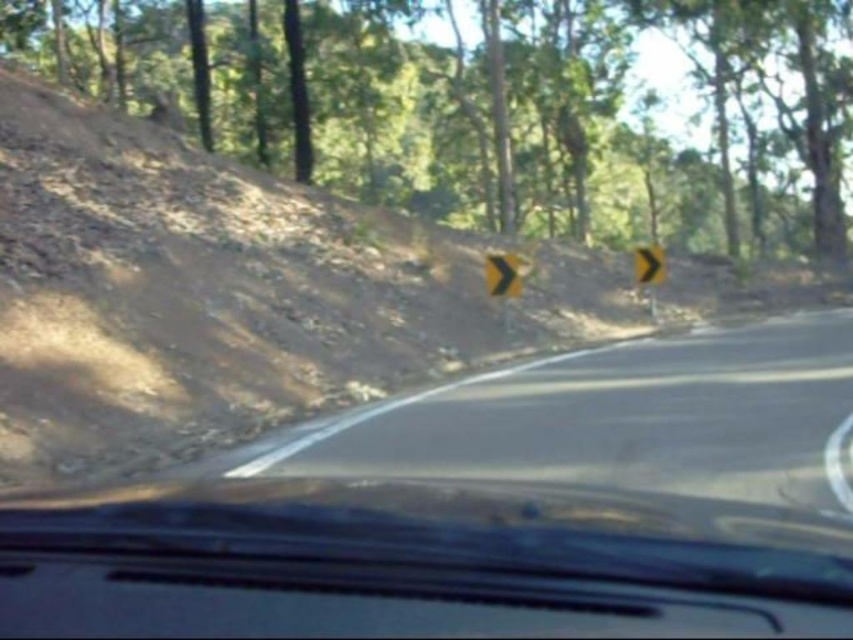
You are driving a car and looking through the windshield. There are two points marked on the road ahead. The first point is at coordinates point [450,596] and the second is at point [647,269]. Which point is closer to your current position?

Point [647,269] is closer to your current position because it is behind point [450,596], which is in front of it.

You are a driver checking the rearview mirror and notice the transparent plastic windshield at center and the yellow matte arrow at upper right in your view. Which object appears wider in your field of view?

The yellow matte arrow at upper right appears wider because the transparent plastic windshield at center has a lesser width compared to yellow matte arrow at upper right.

You are driving a car and see the black asphalt road at center and the yellow matte arrow at center. Which object is positioned more to the right side of the scene?

The black asphalt road at center is positioned more to the right side of the scene compared to the yellow matte arrow at center, as it is located to the right of it.